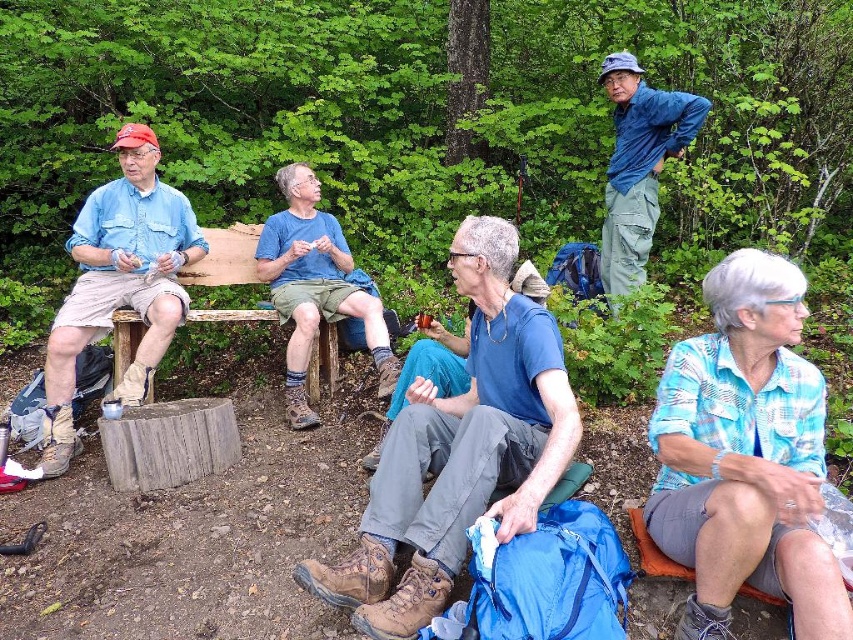
Question: Among these points, which one is farthest from the camera?

Choices:
 (A) (654, 152)
 (B) (810, 422)
 (C) (297, 246)

Answer: (A)

Question: Can you confirm if blue plaid shirt at lower right is positioned to the left of blue cotton shirt at center?

Choices:
 (A) no
 (B) yes

Answer: (A)

Question: Which point is closer to the camera?

Choices:
 (A) (724, 472)
 (B) (45, 420)
 (C) (682, 140)
 (D) (300, 401)

Answer: (A)

Question: Is the position of blue fabric backpack at center less distant than that of blue cotton shirt at center?

Choices:
 (A) no
 (B) yes

Answer: (B)

Question: Which of these objects is positioned farthest from the matte blue shirt at left?

Choices:
 (A) blue plaid shirt at lower right
 (B) blue fabric backpack at center
 (C) blue fabric shirt at upper right

Answer: (A)

Question: Does blue fabric backpack at center lie in front of matte blue shirt at left?

Choices:
 (A) yes
 (B) no

Answer: (A)